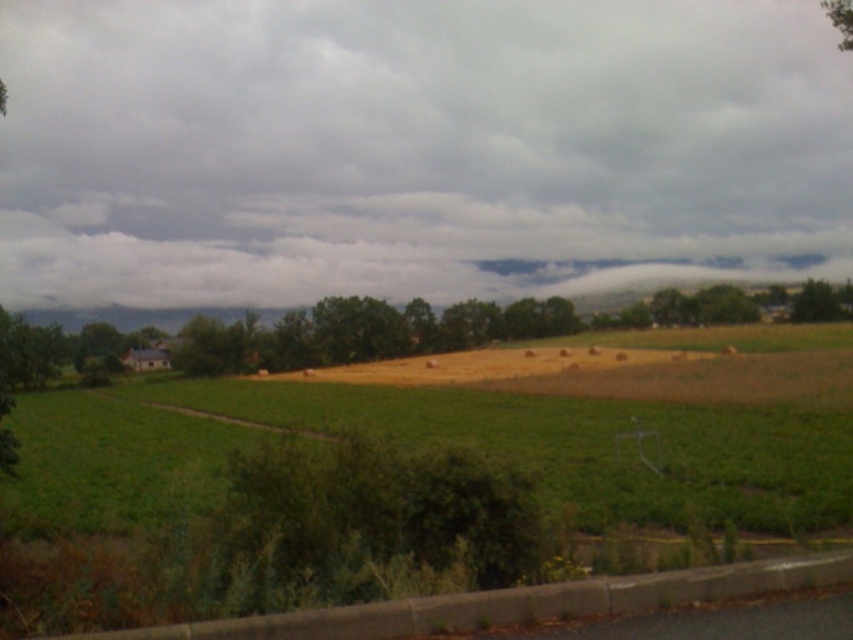
You are standing in the rural landscape and want to take a photo of the cloudy sky at upper center and the green leafy trees at center. Which object will appear closer to you in the photo?

The cloudy sky at upper center will appear closer to you in the photo because it is further to the viewer than the green leafy trees at center.

You are a photographer planning to capture the cloudy sky at upper center and the green leafy trees at center in a single frame. Which object will occupy more of the photo?

The cloudy sky at upper center is larger in size than the green leafy trees at center, so it will occupy more of the photo.

You are a landscape photographer planning to capture the cloudy sky at upper center and the green leafy trees at center in a single frame. Based on the scene, which element occupies a wider portion of the image?

The cloudy sky at upper center occupies a wider portion of the image as its width is larger than that of the green leafy trees at center.